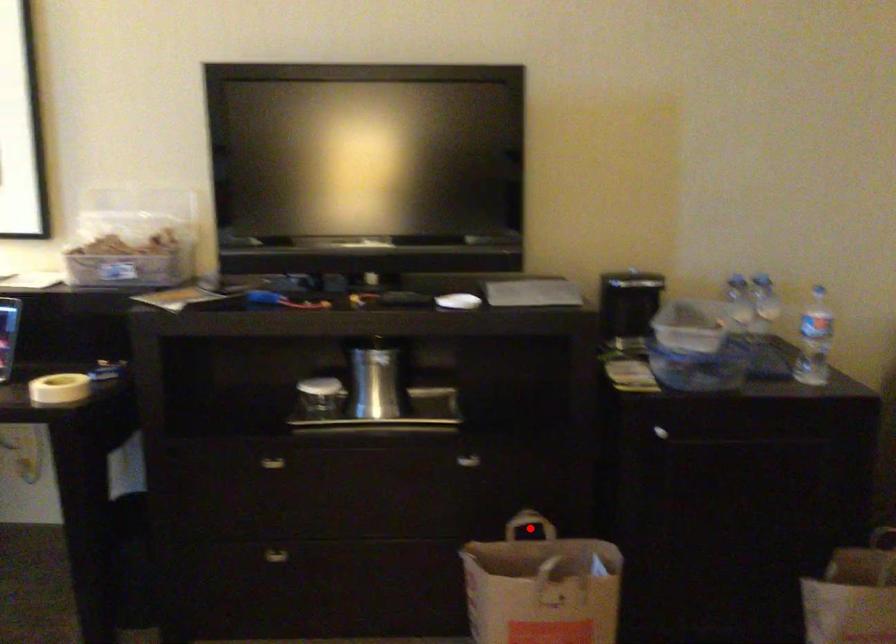
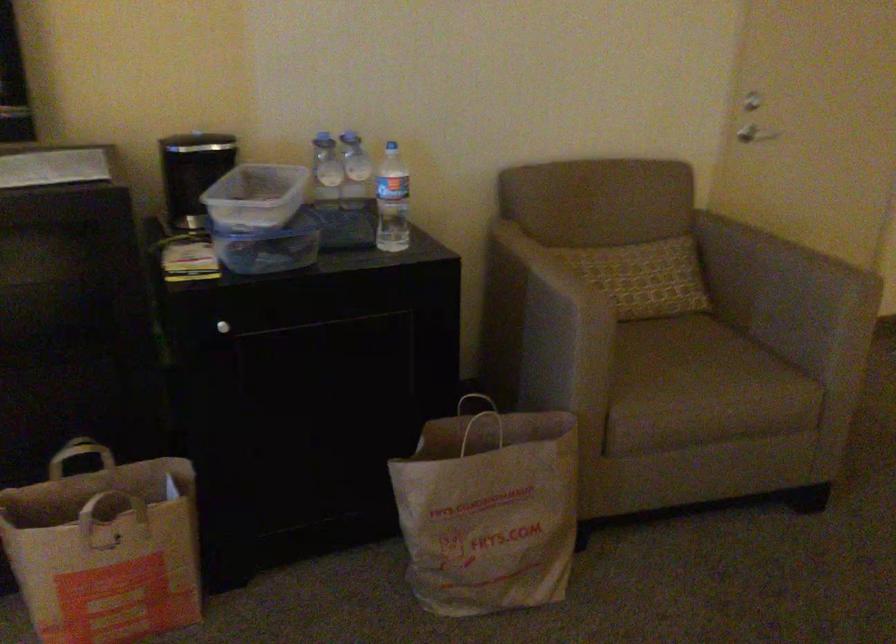
Question: A red point is marked in image1. In image2, is the corresponding 3D point closer to the camera or farther? Reply with the corresponding letter.

Choices:
 (A) The corresponding 3D point is closer.
 (B) The corresponding 3D point is farther.

Answer: (A)